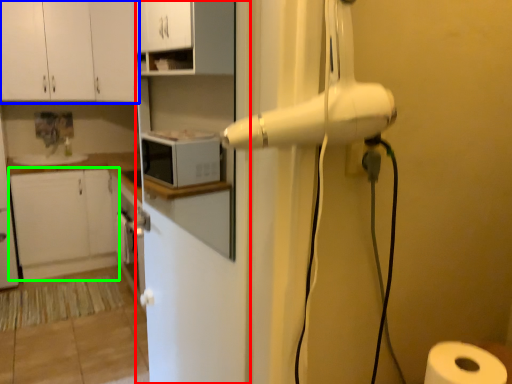
Question: Based on their relative distances, which object is nearer to screen door (highlighted by a red box)? Choose from cabinetry (highlighted by a blue box) and cabinetry (highlighted by a green box).

Choices:
 (A) cabinetry
 (B) cabinetry

Answer: (A)